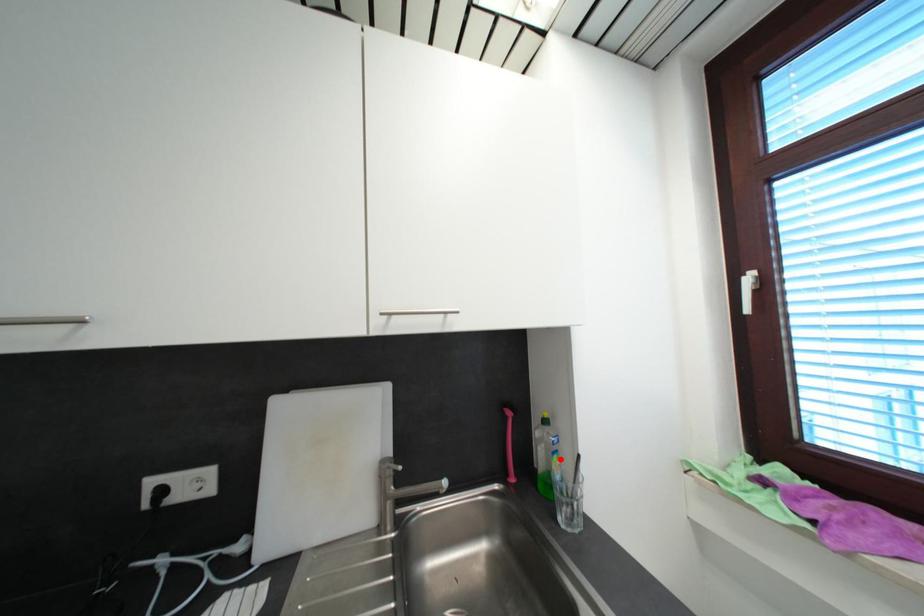
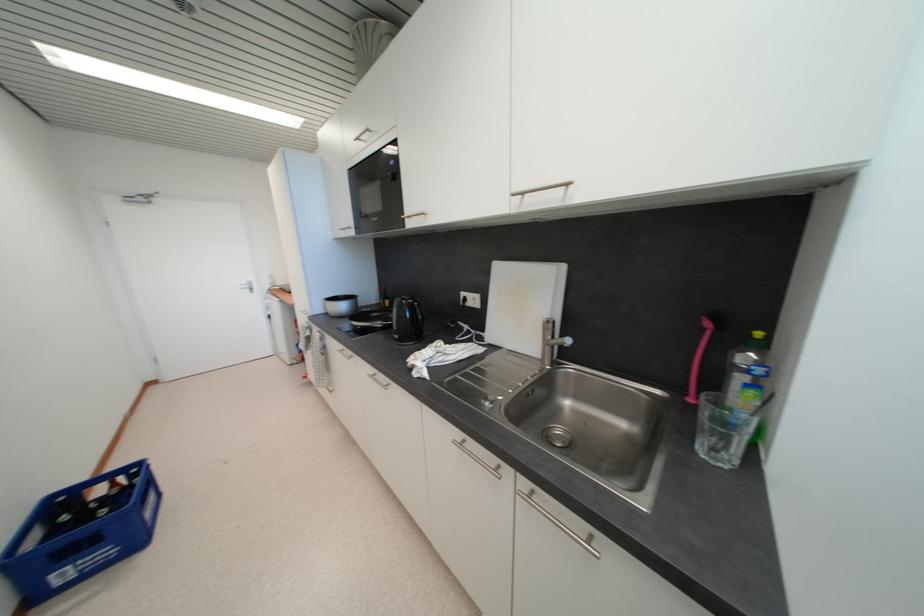
Where in the second image is the point corresponding to the highlighted location from the first image?

(757, 394)